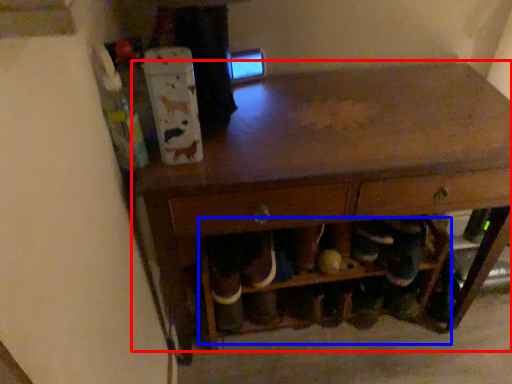
Question: Which point is closer to the camera, table (highlighted by a red box) or shelf (highlighted by a blue box)?

Choices:
 (A) table
 (B) shelf

Answer: (A)